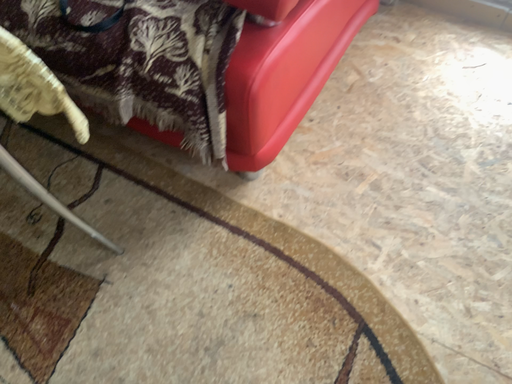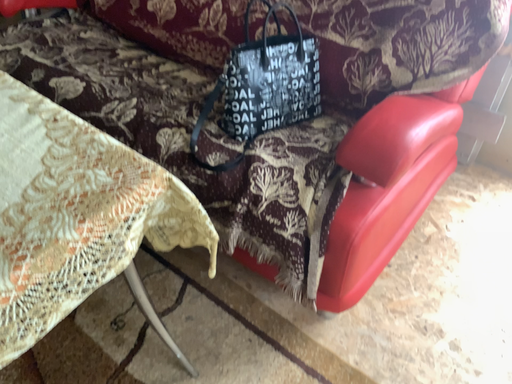
Question: Which way did the camera rotate in the video?

Choices:
 (A) rotated upward
 (B) rotated downward

Answer: (A)